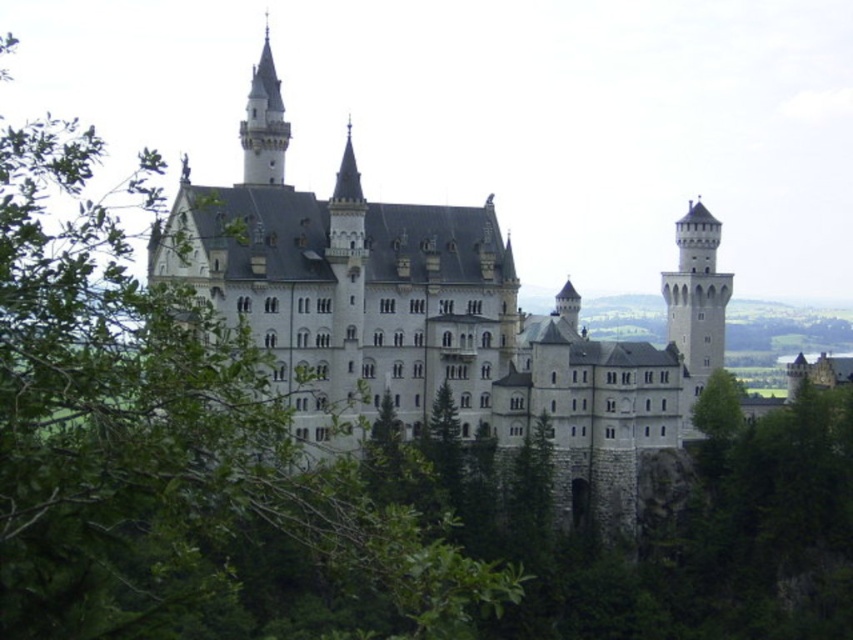
Question: Does white stone tower at right appear on the left side of stone spire at upper left?

Choices:
 (A) yes
 (B) no

Answer: (B)

Question: Does green leafy tree at left have a larger size compared to white stone tower at right?

Choices:
 (A) yes
 (B) no

Answer: (A)

Question: Is white stone castle at center positioned in front of white stone tower at right?

Choices:
 (A) yes
 (B) no

Answer: (A)

Question: Estimate the real-world distances between objects in this image. Which object is farther from the white stone castle at center?

Choices:
 (A) white stone tower at right
 (B) green leafy tree at left
 (C) stone spire at upper left

Answer: (C)

Question: Which point appears closest to the camera in this image?

Choices:
 (A) (82, 548)
 (B) (618, 436)
 (C) (276, 76)

Answer: (A)

Question: Estimate the real-world distances between objects in this image. Which object is farther from the white stone castle at center?

Choices:
 (A) green leafy tree at left
 (B) stone spire at upper left

Answer: (B)